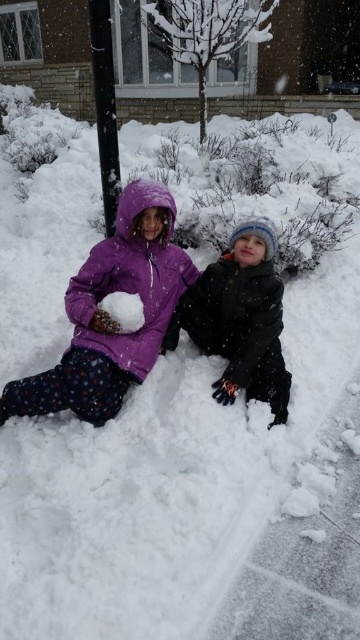
Does black woolen hat at center have a lesser width compared to black smooth pole at upper center?

No, black woolen hat at center is not thinner than black smooth pole at upper center.

Can you confirm if black woolen hat at center is smaller than black smooth pole at upper center?

Actually, black woolen hat at center might be larger than black smooth pole at upper center.

Is point (231, 269) positioned behind point (100, 84)?

No, (231, 269) is closer to viewer.

At what (x,y) coordinates should I click in order to perform the action: click on black woolen hat at center. Please return your answer as a coordinate pair (x, y). Looking at the image, I should click on (240, 317).

I want to click on purple fleece jacket at center, so click(x=164, y=316).

Does purple fleece jacket at center lie behind black smooth pole at upper center?

No, it is not.

Does point (105, 323) come farther from viewer compared to point (104, 60)?

No, (105, 323) is closer to viewer.

Where is `purple fleece jacket at center`? purple fleece jacket at center is located at coordinates (164, 316).

The height and width of the screenshot is (640, 360). What do you see at coordinates (303, 557) in the screenshot?
I see `white concrete pavement at lower center` at bounding box center [303, 557].

Between point (279, 604) and point (127, 317), which one is positioned behind?

The point (127, 317) is more distant.

You are a GUI agent. You are given a task and a screenshot of the screen. Output one action in this format:
    pyautogui.click(x=<x>, y=<y>)
    Task: Click on the white concrete pavement at lower center
    This screenshot has width=360, height=640.
    Given the screenshot: What is the action you would take?
    pyautogui.click(x=303, y=557)

This screenshot has width=360, height=640. In order to click on white concrete pavement at lower center in this screenshot , I will do `click(303, 557)`.